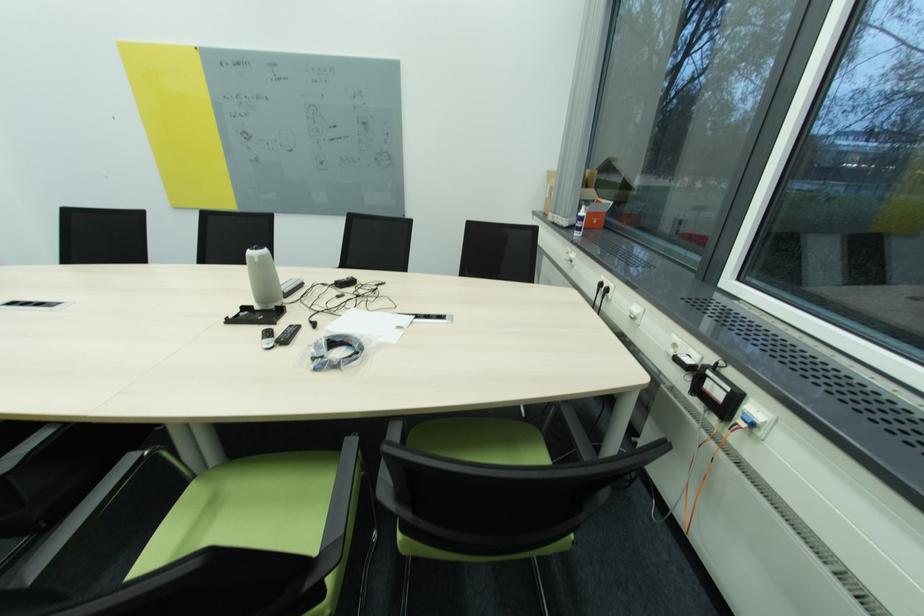
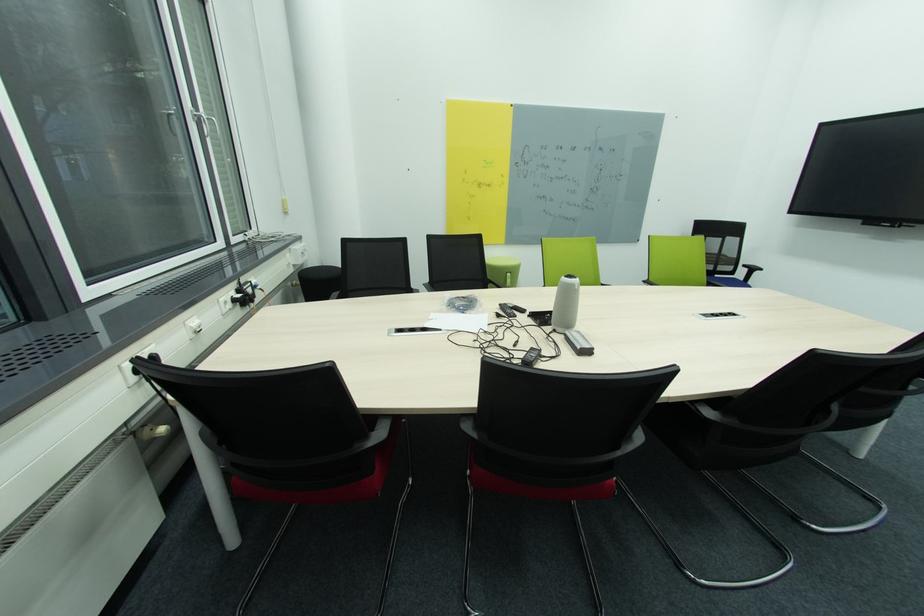
Locate, in the second image, the point that corresponds to point 404,315 in the first image.

(444, 331)